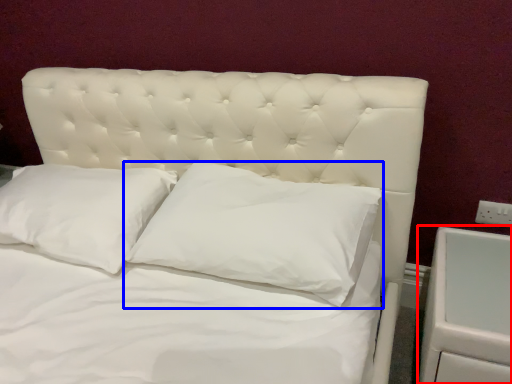
Question: Which of the following is the farthest to the observer, dresser (highlighted by a red box) or pillow (highlighted by a blue box)?

Choices:
 (A) dresser
 (B) pillow

Answer: (B)